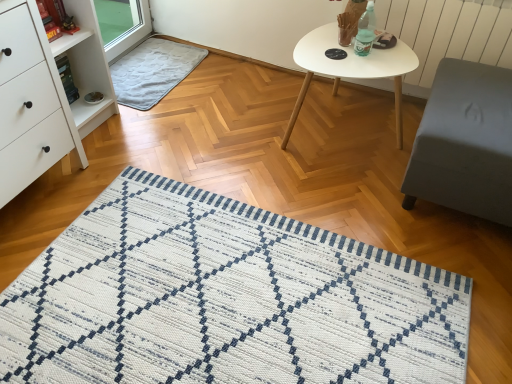
You are a GUI agent. You are given a task and a screenshot of the screen. Output one action in this format:
    pyautogui.click(x=<x>, y=<y>)
    Task: Click on the free space in front of gray soft rug at upper left
    The image size is (512, 384).
    Given the screenshot: What is the action you would take?
    coord(162,130)